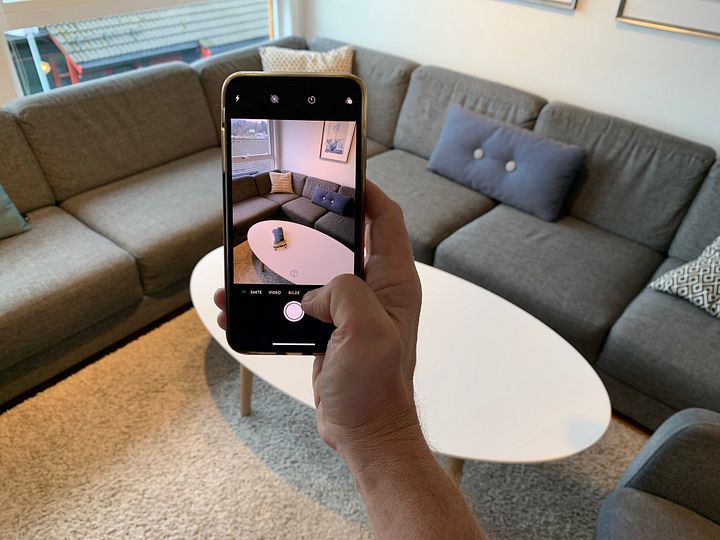
Find the location of a particular element. This screenshot has width=720, height=540. grey couch is located at coordinates (132, 166).